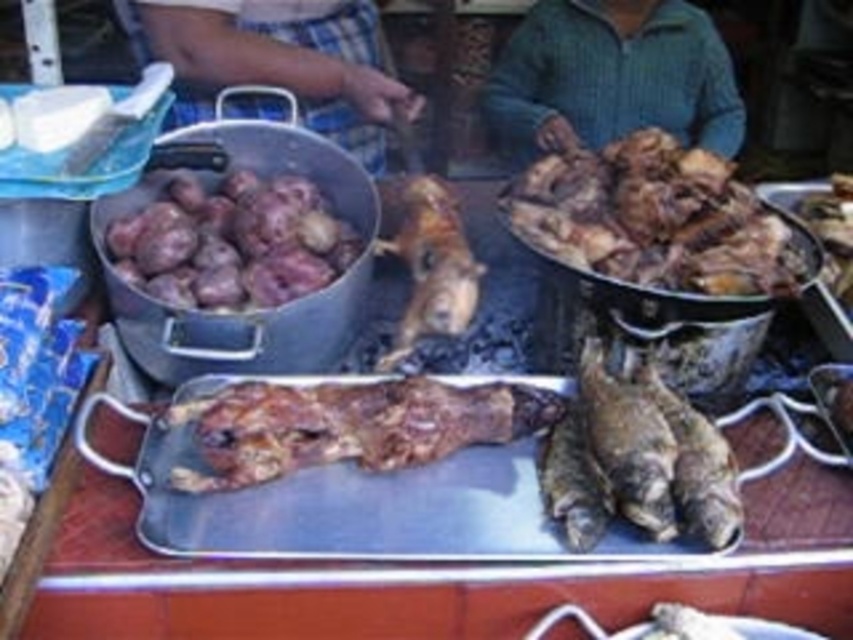
Looking at this image, you are standing in front of the street food stall and want to reach the point marked at coordinates point [219,410]. If your arm can reach 3 feet, can you touch the point without moving your feet?

The distance between you and point [219,410] is 4.22 feet, which is longer than your 3 feet reach. Therefore, you cannot touch the point without moving your feet.

You are a customer at the food stall and want to order the roasted meat closest to the front of the display. The roasted meats are located at point (460,275) and point (833,193). Which point should you ask the vendor for?

The roasted meat at point (460,275) is closer to the front of the display compared to the one at point (833,193), so you should ask for the meat at point (460,275).

You are a customer at the food stall and want to order the brown crispy chicken at upper right and the brown crispy meat at center. The vendor asks you to point out their positions. Which one is located to the right side of the other?

The brown crispy chicken at upper right is to the right of brown crispy meat at center.